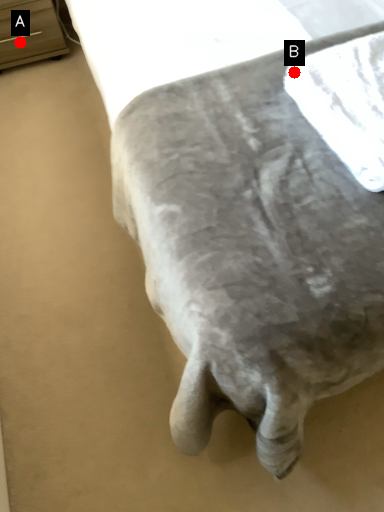
Question: Two points are circled on the image, labeled by A and B beside each circle. Which point is farther to the camera?

Choices:
 (A) A is further
 (B) B is further

Answer: (A)